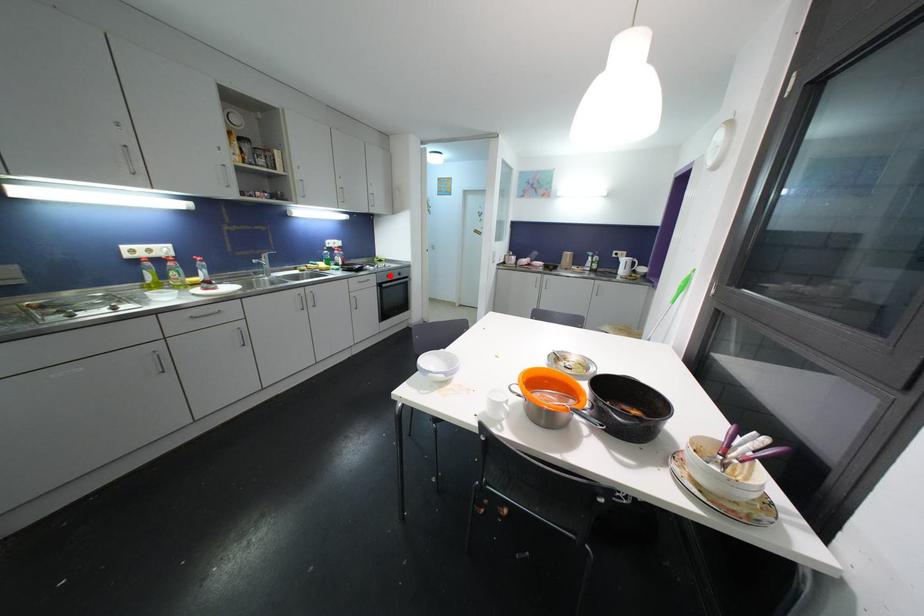
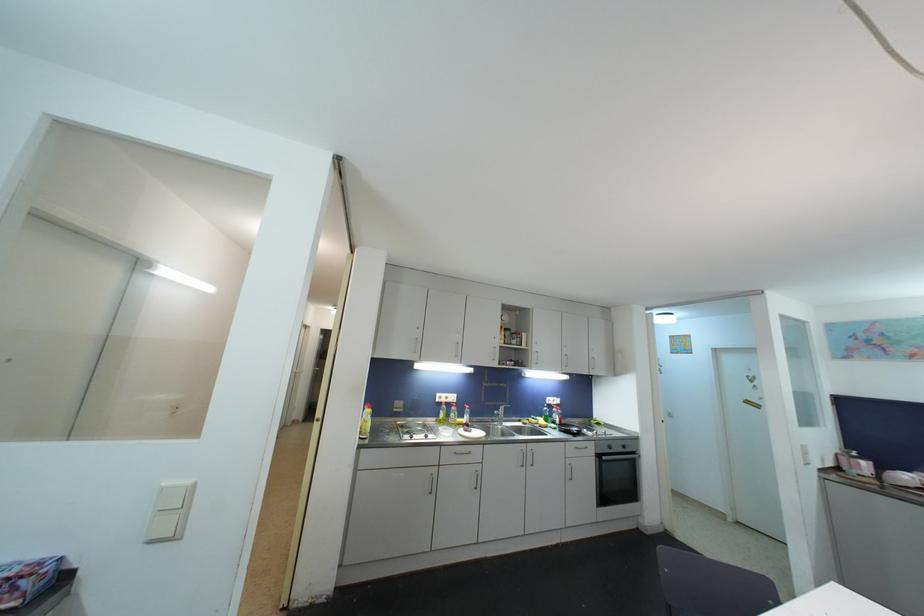
Question: I am providing you with two images of the same scene from different viewpoints. In image1, a red point is highlighted. Considering the same 3D point in image2, which of the following is correct?

Choices:
 (A) It is closer
 (B) It is farther

Answer: (B)